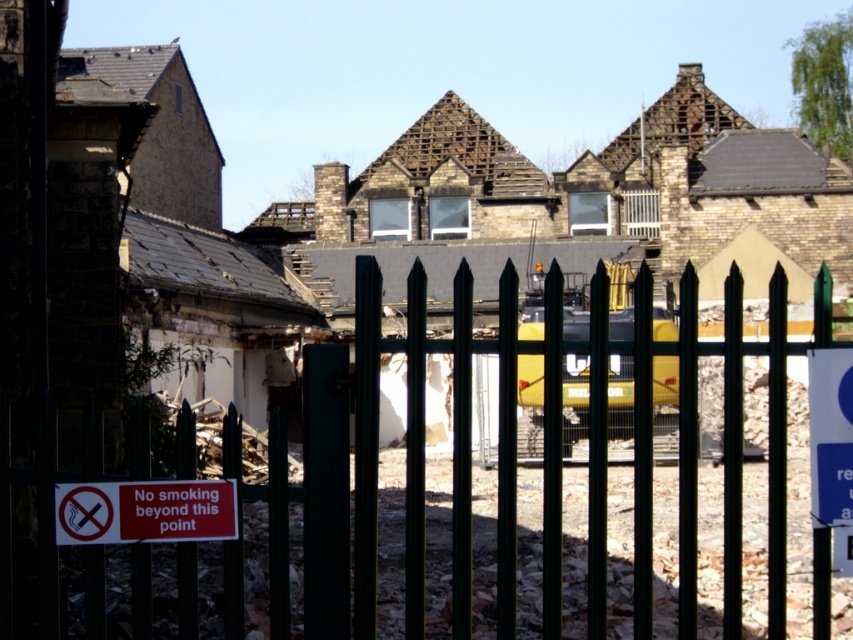
Question: Which point is farther to the camera?

Choices:
 (A) (833, 353)
 (B) (605, 531)
 (C) (193, 492)

Answer: (A)

Question: Estimate the real-world distances between objects in this image. Which object is closer to the white plastic sign at right?

Choices:
 (A) red plastic sign at lower left
 (B) green metal fence at center

Answer: (A)

Question: Does green metal fence at center appear over red plastic sign at lower left?

Choices:
 (A) yes
 (B) no

Answer: (A)

Question: Can you confirm if red plastic sign at lower left is positioned below white plastic sign at right?

Choices:
 (A) yes
 (B) no

Answer: (A)

Question: Does red plastic sign at lower left have a larger size compared to white plastic sign at right?

Choices:
 (A) yes
 (B) no

Answer: (B)

Question: Which point is farther from the camera taking this photo?

Choices:
 (A) (831, 348)
 (B) (776, 305)

Answer: (A)